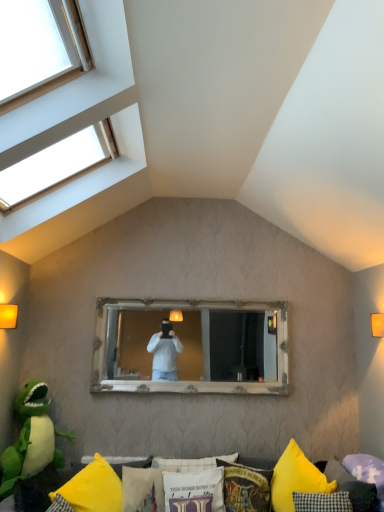
Image resolution: width=384 pixels, height=512 pixels. What do you see at coordinates (225, 346) in the screenshot?
I see `white wooden mirror at center` at bounding box center [225, 346].

The width and height of the screenshot is (384, 512). I want to click on yellow fabric pillow at lower center, the second pillow viewed from the left, so click(128, 463).

Describe the element at coordinates (93, 488) in the screenshot. I see `yellow fabric pillow at lower center, the first pillow viewed from the left` at that location.

Find the location of a particular element. harry potter-themed fabric pillow at lower center, which is the 2th pillow from right to left is located at coordinates (246, 487).

Is point (47, 385) closer to camera compared to point (341, 489)?

That is False.

From a real-world perspective, which object rests below the other?

purple fabric pillow at lower right, which is the 5th pillow from left to right, is physically lower.

How much distance is there between green plush toy at lower left and purple fabric pillow at lower right, which is the 5th pillow from left to right?

They are 2.10 meters apart.

From the image's perspective, which object appears higher, green plush toy at lower left or purple fabric pillow at lower right, which ranks as the first pillow in right-to-left order?

From the image's view, green plush toy at lower left is above.

Which object is wider, harry potter-themed fabric pillow at lower center, acting as the fourth pillow starting from the left, or clear glass window at upper left?

clear glass window at upper left.

From a real-world perspective, between harry potter-themed fabric pillow at lower center, which is the 2th pillow from right to left, and clear glass window at upper left, who is vertically lower?

harry potter-themed fabric pillow at lower center, which is the 2th pillow from right to left, from a real-world perspective.

Which point is more distant from viewer, (243, 486) or (118, 65)?

Point (243, 486)

I want to click on parrot that is above the harry potter-themed fabric pillow at lower center, acting as the fourth pillow starting from the left (from the image's perspective), so click(x=31, y=438).

From a real-world perspective, between green plush toy at lower left and harry potter-themed fabric pillow at lower center, acting as the fourth pillow starting from the left, who is vertically lower?

harry potter-themed fabric pillow at lower center, acting as the fourth pillow starting from the left, from a real-world perspective.

Which object is positioned more to the right, green plush toy at lower left or harry potter-themed fabric pillow at lower center, acting as the fourth pillow starting from the left?

harry potter-themed fabric pillow at lower center, acting as the fourth pillow starting from the left, is more to the right.

Is green plush toy at lower left situated inside harry potter-themed fabric pillow at lower center, acting as the fourth pillow starting from the left, or outside?

green plush toy at lower left lies outside harry potter-themed fabric pillow at lower center, acting as the fourth pillow starting from the left.

Does yellow fabric pillow at lower center, which is the 4th pillow from right to left, turn towards white wooden mirror at center?

No, yellow fabric pillow at lower center, which is the 4th pillow from right to left, is not facing towards white wooden mirror at center.

Is yellow fabric pillow at lower center, which is the 4th pillow from right to left, situated inside white wooden mirror at center or outside?

yellow fabric pillow at lower center, which is the 4th pillow from right to left, lies outside white wooden mirror at center.

Is point (125, 464) farther from viewer compared to point (146, 373)?

No, it is in front of (146, 373).

Is yellow fabric cushion at lower center bigger or smaller than yellow fabric pillow at lower center, the second pillow viewed from the left?

Clearly, yellow fabric cushion at lower center is larger in size than yellow fabric pillow at lower center, the second pillow viewed from the left.

Could you measure the distance between yellow fabric cushion at lower center and yellow fabric pillow at lower center, the second pillow viewed from the left?

They are 17.81 inches apart.

From the image's perspective, does yellow fabric cushion at lower center appear higher than yellow fabric pillow at lower center, the second pillow viewed from the left?

No.

Which is more to the left, yellow fabric cushion at lower center or yellow fabric pillow at lower center, which is the 4th pillow from right to left?

yellow fabric pillow at lower center, which is the 4th pillow from right to left.

Could you tell me if yellow fabric pillow at lower center, which is the 4th pillow from right to left, is turned towards clear glass window at upper left?

No, yellow fabric pillow at lower center, which is the 4th pillow from right to left, is not facing towards clear glass window at upper left.

Is there a large distance between yellow fabric pillow at lower center, which is the 4th pillow from right to left, and clear glass window at upper left?

yellow fabric pillow at lower center, which is the 4th pillow from right to left, is far away from clear glass window at upper left.

From a real-world perspective, who is located lower, yellow fabric pillow at lower center, the second pillow viewed from the left, or clear glass window at upper left?

In real-world perspective, yellow fabric pillow at lower center, the second pillow viewed from the left, is lower.

From the image's perspective, is yellow fabric pillow at lower center, the second pillow viewed from the left, above clear glass window at upper left?

No, from the image's perspective, yellow fabric pillow at lower center, the second pillow viewed from the left, is not on top of clear glass window at upper left.

From a real-world perspective, is white fabric pillow at lower center, arranged as the third pillow when viewed from the right, located higher than green plush toy at lower left?

Actually, white fabric pillow at lower center, arranged as the third pillow when viewed from the right, is physically below green plush toy at lower left in the real world.

Where is `the 1st pillow in front of the green plush toy at lower left, starting your count from the anchor`? The width and height of the screenshot is (384, 512). the 1st pillow in front of the green plush toy at lower left, starting your count from the anchor is located at coordinates (142, 489).

From the image's perspective, between white fabric pillow at lower center, arranged as the third pillow when viewed from the right, and green plush toy at lower left, which one is located above?

green plush toy at lower left.

Where is `the 3rd pillow positioned below the green plush toy at lower left (from the image's perspective)`? This screenshot has width=384, height=512. the 3rd pillow positioned below the green plush toy at lower left (from the image's perspective) is located at coordinates (351, 486).

You are a GUI agent. You are given a task and a screenshot of the screen. Output one action in this format:
    pyautogui.click(x=<x>, y=<y>)
    Task: Click on the window that is on the left side of harry potter-themed fabric pillow at lower center, acting as the fourth pillow starting from the left
    
    Given the screenshot: What is the action you would take?
    pyautogui.click(x=77, y=89)

Based on their spatial positions, is harry potter-themed fabric pillow at lower center, acting as the fourth pillow starting from the left, or white wooden mirror at center closer to clear glass window at upper left?

The object closer to clear glass window at upper left is white wooden mirror at center.

When comparing their distances from yellow fabric pillow at lower center, which is the 4th pillow from right to left, does yellow fabric pillow at lower center, marked as the 5th pillow in a right-to-left arrangement, or white fabric pillow at lower center, arranged as the third pillow when viewed from the right, seem further?

Based on the image, yellow fabric pillow at lower center, marked as the 5th pillow in a right-to-left arrangement, appears to be further to yellow fabric pillow at lower center, which is the 4th pillow from right to left.

Based on their spatial positions, is yellow fabric pillow at lower center, which is the 4th pillow from right to left, or purple fabric pillow at lower right, which is the 5th pillow from left to right, further from green plush toy at lower left?

purple fabric pillow at lower right, which is the 5th pillow from left to right, lies further to green plush toy at lower left than the other object.

Looking at the image, which one is located further to purple fabric pillow at lower right, which is the 5th pillow from left to right, white wooden mirror at center or yellow fabric pillow at lower center, which is the 4th pillow from right to left?

yellow fabric pillow at lower center, which is the 4th pillow from right to left, is positioned further to the anchor purple fabric pillow at lower right, which is the 5th pillow from left to right.

Which object lies nearer to the anchor point white fabric pillow at lower center, the third pillow positioned from the left, green plush toy at lower left or yellow fabric cushion at lower center?

Among the two, yellow fabric cushion at lower center is located nearer to white fabric pillow at lower center, the third pillow positioned from the left.

Looking at the image, which one is located closer to green plush toy at lower left, white fabric pillow at lower center, arranged as the third pillow when viewed from the right, or yellow fabric pillow at lower center, which is the 4th pillow from right to left?

Among the two, yellow fabric pillow at lower center, which is the 4th pillow from right to left, is located nearer to green plush toy at lower left.

When comparing their distances from clear glass window at upper left, does white fabric pillow at lower center, the third pillow positioned from the left, or yellow fabric cushion at lower center seem further?

The object further to clear glass window at upper left is yellow fabric cushion at lower center.

Which object lies further to the anchor point yellow fabric cushion at lower center, purple fabric pillow at lower right, which is the 5th pillow from left to right, or yellow fabric pillow at lower center, the second pillow viewed from the left?

Among the two, purple fabric pillow at lower right, which is the 5th pillow from left to right, is located further to yellow fabric cushion at lower center.

I want to click on pillow located between white wooden mirror at center and purple fabric pillow at lower right, which ranks as the first pillow in right-to-left order, in the left-right direction, so click(246, 487).

Locate an element on the screen. The height and width of the screenshot is (512, 384). parrot between clear glass window at upper left and purple fabric pillow at lower right, which ranks as the first pillow in right-to-left order, in the up-down direction is located at coordinates (31, 438).

Where is `mirror that lies between clear glass window at upper left and yellow fabric pillow at lower center, the first pillow viewed from the left, from top to bottom`? Image resolution: width=384 pixels, height=512 pixels. mirror that lies between clear glass window at upper left and yellow fabric pillow at lower center, the first pillow viewed from the left, from top to bottom is located at coordinates (225, 346).

The height and width of the screenshot is (512, 384). Find the location of `parrot between clear glass window at upper left and harry potter-themed fabric pillow at lower center, which is the 2th pillow from right to left, in the up-down direction`. parrot between clear glass window at upper left and harry potter-themed fabric pillow at lower center, which is the 2th pillow from right to left, in the up-down direction is located at coordinates (31, 438).